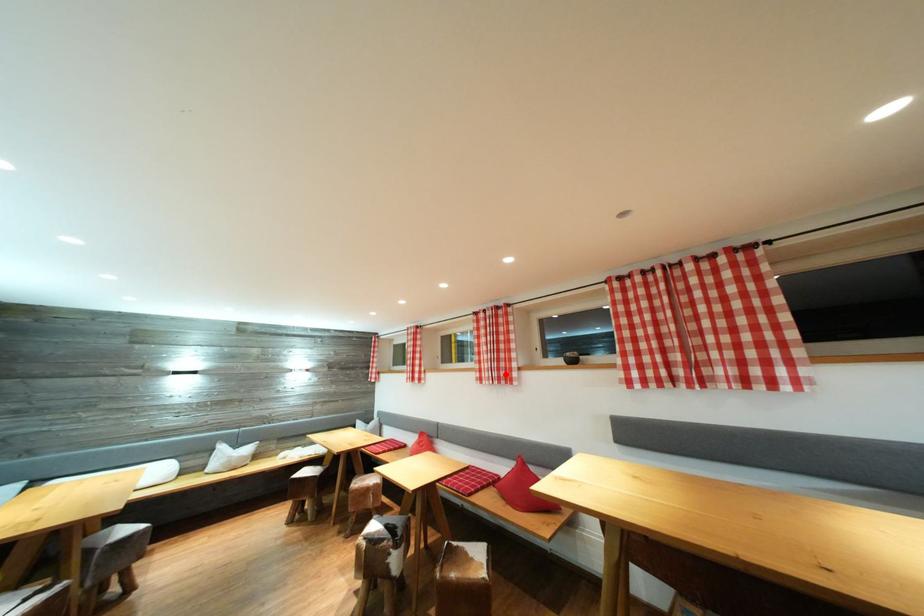
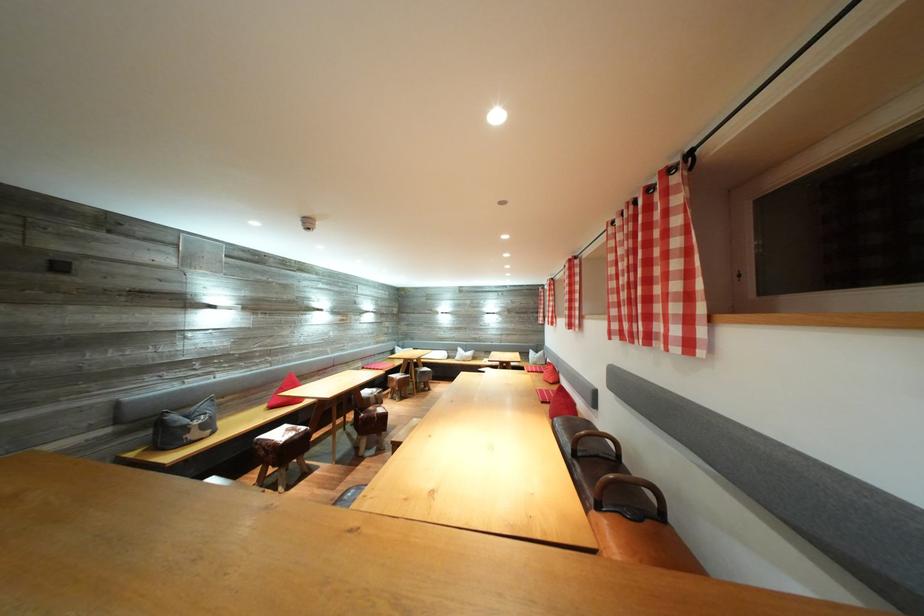
In the second image, find the point that corresponds to the highlighted location in the first image.

(578, 322)